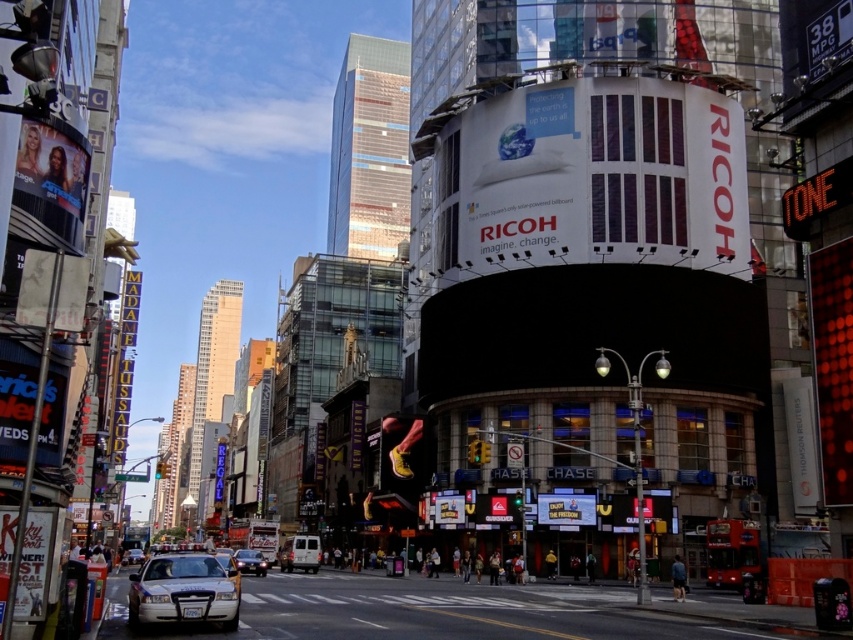
Looking at this image, can you confirm if yellow matte skateboard at center is positioned below white glossy car at lower left?

No.

Is yellow matte skateboard at center above white glossy car at lower left?

Correct, yellow matte skateboard at center is located above white glossy car at lower left.

Find the location of `yellow matte skateboard at center`. yellow matte skateboard at center is located at coordinates (399, 445).

Where is `white matte van at center`? white matte van at center is located at coordinates (300, 554).

At what (x,y) coordinates should I click in order to perform the action: click on white matte van at center. Please return your answer as a coordinate pair (x, y). The height and width of the screenshot is (640, 853). Looking at the image, I should click on (300, 554).

Between white glossy police car at lower left and white glossy car at center, which one is positioned higher?

white glossy police car at lower left

Is white glossy police car at lower left taller than white glossy car at center?

Yes, white glossy police car at lower left is taller than white glossy car at center.

Who is more distant from viewer, (228, 612) or (241, 566)?

The point (241, 566) is more distant.

The width and height of the screenshot is (853, 640). What are the coordinates of `white glossy police car at lower left` in the screenshot? It's located at (183, 589).